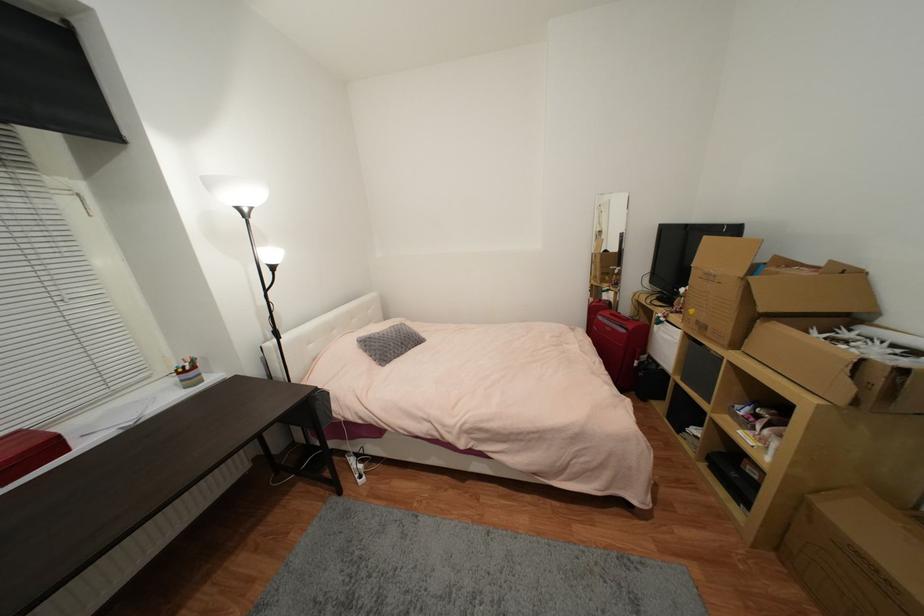
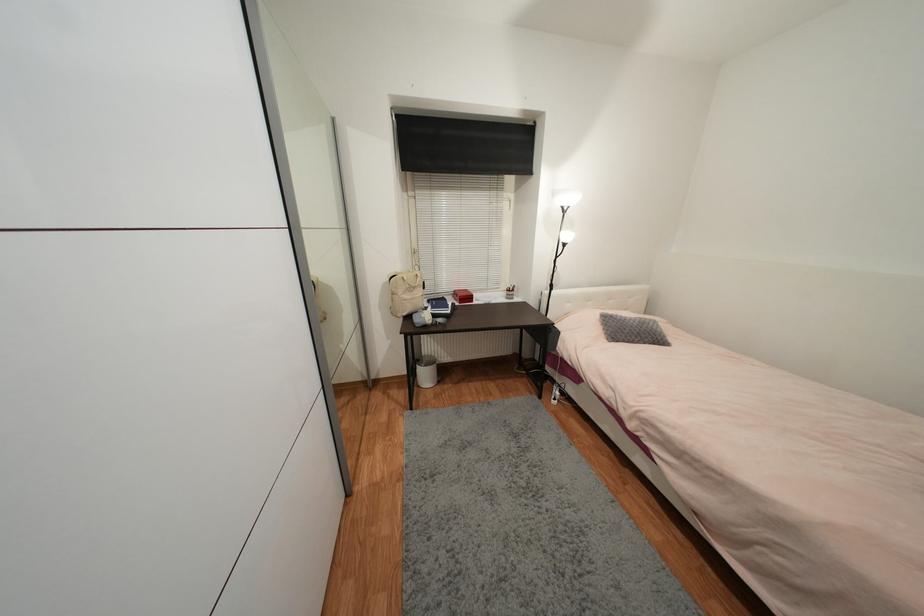
Where in the second image is the point corresponding to point (341, 460) from the first image?

(553, 383)